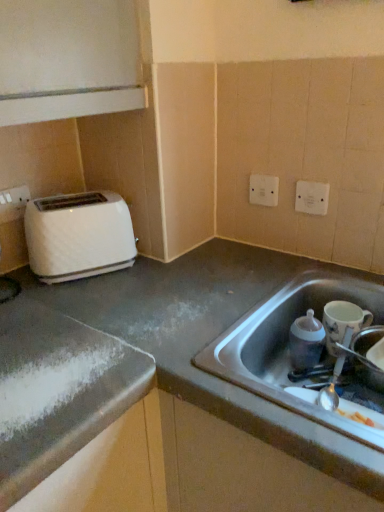
Question: From the image's perspective, is white plastic electric outlet at upper right, the first electric outlet from the front, beneath stainless steel sink at lower right?

Choices:
 (A) no
 (B) yes

Answer: (A)

Question: Is white plastic electric outlet at upper right, acting as the second electric outlet starting from the left, completely or partially outside of stainless steel sink at lower right?

Choices:
 (A) no
 (B) yes

Answer: (B)

Question: Is white plastic electric outlet at upper right, acting as the second electric outlet starting from the left, at the right side of stainless steel sink at lower right?

Choices:
 (A) yes
 (B) no

Answer: (A)

Question: Considering the relative sizes of white plastic electric outlet at upper right, acting as the second electric outlet starting from the left, and stainless steel sink at lower right in the image provided, is white plastic electric outlet at upper right, acting as the second electric outlet starting from the left, wider than stainless steel sink at lower right?

Choices:
 (A) yes
 (B) no

Answer: (B)

Question: Can you confirm if white plastic electric outlet at upper right, the first electric outlet from the right, is smaller than stainless steel sink at lower right?

Choices:
 (A) yes
 (B) no

Answer: (A)

Question: Is stainless steel sink at lower right wider than white plastic electric outlet at upper right, the first electric outlet from the right?

Choices:
 (A) no
 (B) yes

Answer: (B)

Question: Could you tell me if stainless steel sink at lower right is turned towards white plastic electric outlet at upper right, the first electric outlet from the right?

Choices:
 (A) yes
 (B) no

Answer: (B)

Question: From a real-world perspective, is stainless steel sink at lower right located beneath white plastic electric outlet at upper right, acting as the second electric outlet starting from the left?

Choices:
 (A) yes
 (B) no

Answer: (A)

Question: Considering the relative sizes of stainless steel sink at lower right and white plastic electric outlet at upper right, acting as the second electric outlet starting from the left, in the image provided, is stainless steel sink at lower right bigger than white plastic electric outlet at upper right, acting as the second electric outlet starting from the left,?

Choices:
 (A) yes
 (B) no

Answer: (A)

Question: Would you say stainless steel sink at lower right contains white plastic electric outlet at upper right, the first electric outlet from the right?

Choices:
 (A) yes
 (B) no

Answer: (B)

Question: Is stainless steel sink at lower right to the left of white plastic electric outlet at upper right, the first electric outlet from the right, from the viewer's perspective?

Choices:
 (A) no
 (B) yes

Answer: (B)

Question: Does smooth gray countertop at lower right have a lesser height compared to matte plastic baby bottle at sink, arranged as the third appliance when viewed from the right?

Choices:
 (A) no
 (B) yes

Answer: (A)